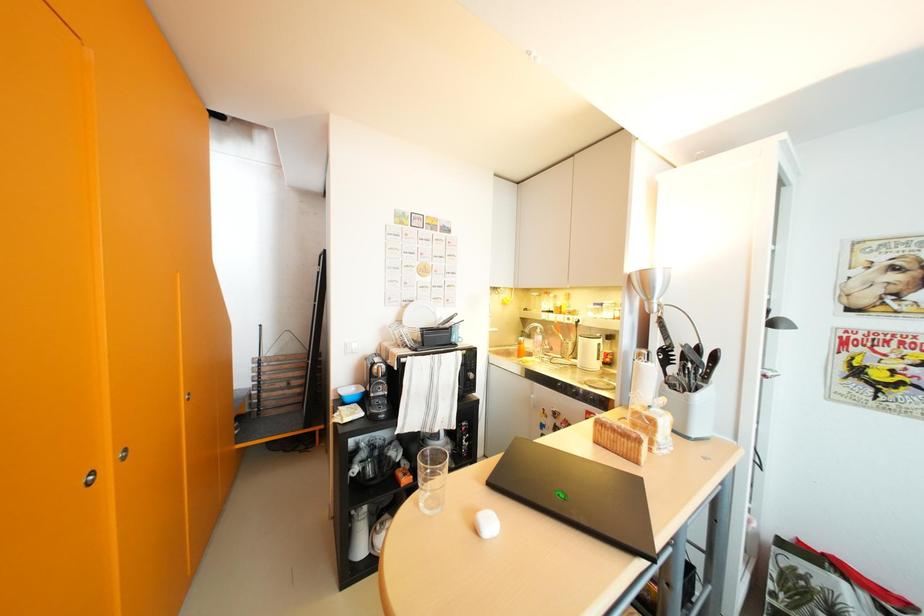
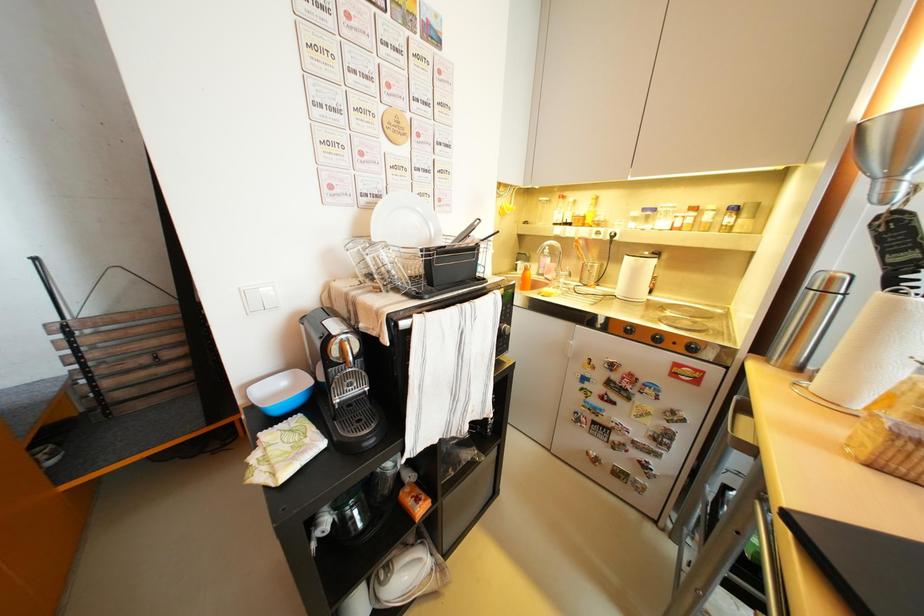
Question: Based on the continuous images, in which direction is the camera rotating? Reply with the corresponding letter.

Choices:
 (A) Left
 (B) Right
 (C) Up
 (D) Down

Answer: (D)